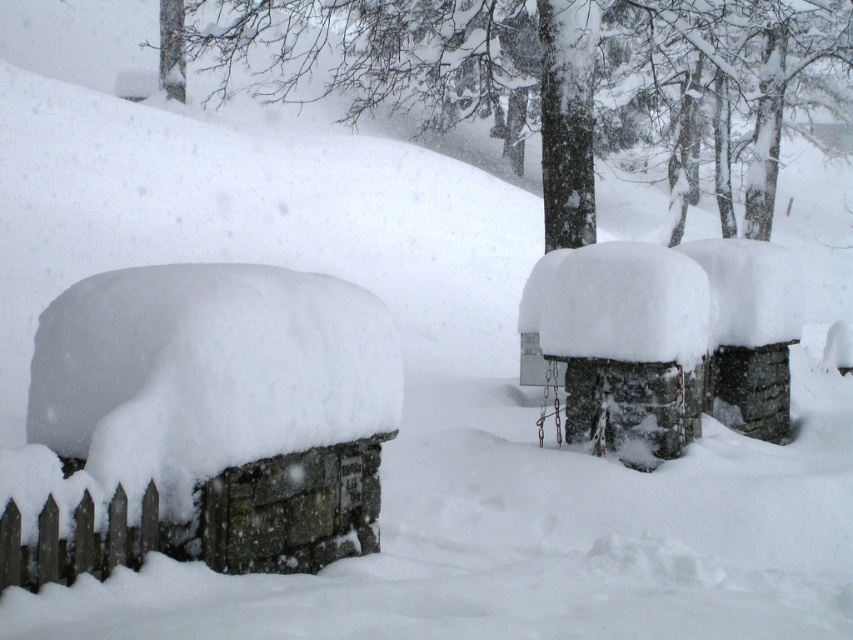
Question: Does snow-covered tree at upper center have a greater width compared to brown wooden fence at lower left?

Choices:
 (A) yes
 (B) no

Answer: (A)

Question: Is snow-covered tree at upper center above brown wooden fence at lower left?

Choices:
 (A) no
 (B) yes

Answer: (B)

Question: Among these points, which one is farthest from the camera?

Choices:
 (A) (747, 125)
 (B) (305, 502)

Answer: (A)

Question: Which of the following is the farthest from the observer?

Choices:
 (A) snow-covered tree at upper center
 (B) brown wooden fence at lower left

Answer: (A)

Question: Which point is closer to the camera?

Choices:
 (A) (80, 525)
 (B) (514, 33)

Answer: (A)

Question: Is snow-covered tree at upper center bigger than brown wooden fence at lower left?

Choices:
 (A) yes
 (B) no

Answer: (A)